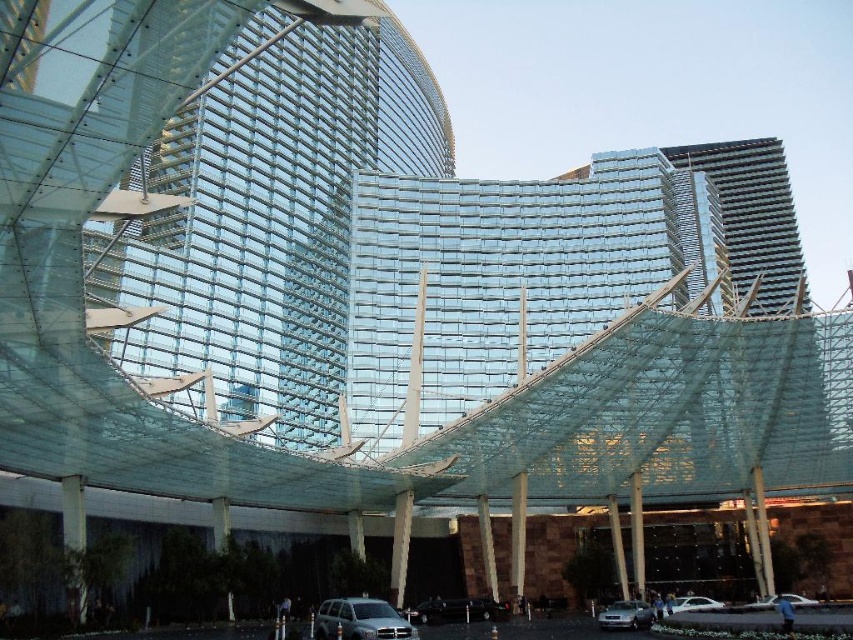
Which is behind, point (323, 616) or point (782, 593)?

Point (782, 593)

Is the position of silver metallic suv at lower center less distant than that of silver metallic car at lower center?

Yes, silver metallic suv at lower center is closer to the viewer.

Between point (373, 630) and point (762, 598), which one is positioned in front?

Point (373, 630) is in front.

What are the coordinates of `silver metallic suv at lower center` in the screenshot? It's located at (360, 620).

Can you confirm if silver metallic sedan at lower center is positioned below silver metallic car at lower center?

Indeed, silver metallic sedan at lower center is positioned under silver metallic car at lower center.

Can you confirm if silver metallic sedan at lower center is smaller than silver metallic car at lower center?

Yes, silver metallic sedan at lower center is smaller than silver metallic car at lower center.

Is point (634, 618) less distant than point (793, 595)?

Yes, point (634, 618) is closer to viewer.

Find the location of `silver metallic sedan at lower center`. silver metallic sedan at lower center is located at coordinates (625, 616).

Is shiny black car at center below silver metallic car at lower center?

Indeed, shiny black car at center is positioned under silver metallic car at lower center.

Does shiny black car at center have a smaller size compared to silver metallic car at lower center?

Correct, shiny black car at center occupies less space than silver metallic car at lower center.

Does point (471, 598) come closer to viewer compared to point (788, 602)?

No, it is behind (788, 602).

Where is `shiny black car at center`? This screenshot has width=853, height=640. shiny black car at center is located at coordinates (457, 611).